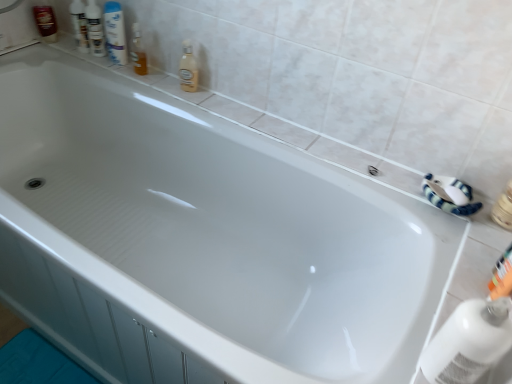
Find the location of a particular element. free space to the left of matte white pump bottle at upper left, acting as the 3th toiletry starting from the top is located at coordinates (60, 43).